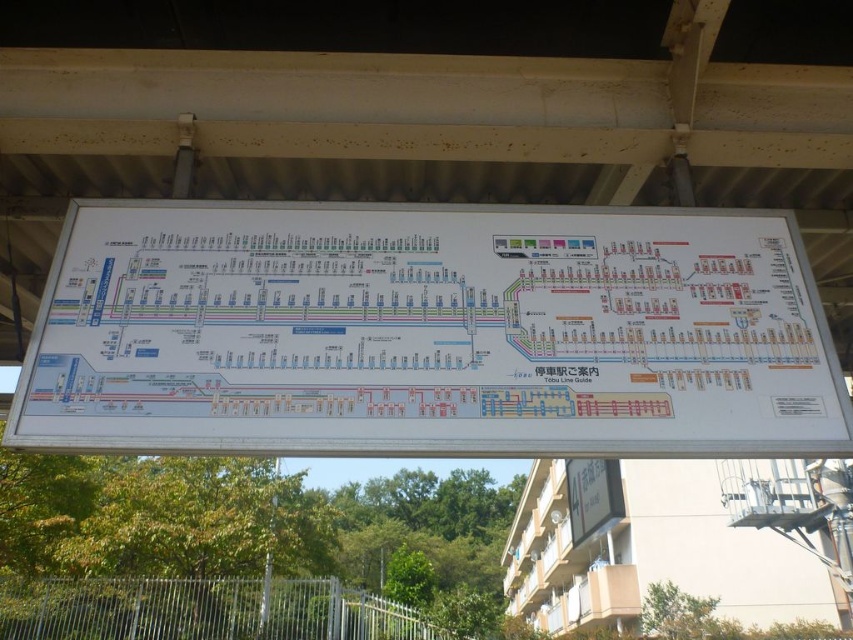
Question: Can you confirm if white paper map at center is wider than white paper signboard at center?

Choices:
 (A) no
 (B) yes

Answer: (A)

Question: Which point is farther from the camera taking this photo?

Choices:
 (A) (105, 156)
 (B) (766, 433)

Answer: (A)

Question: Is white paper map at center in front of white paper signboard at center?

Choices:
 (A) no
 (B) yes

Answer: (B)

Question: Is white paper map at center wider than white paper signboard at center?

Choices:
 (A) no
 (B) yes

Answer: (A)